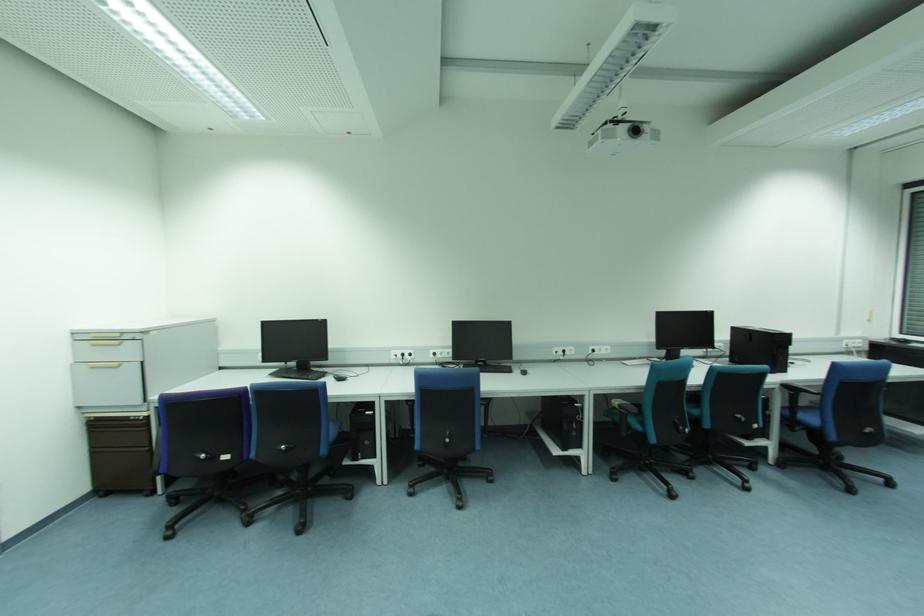
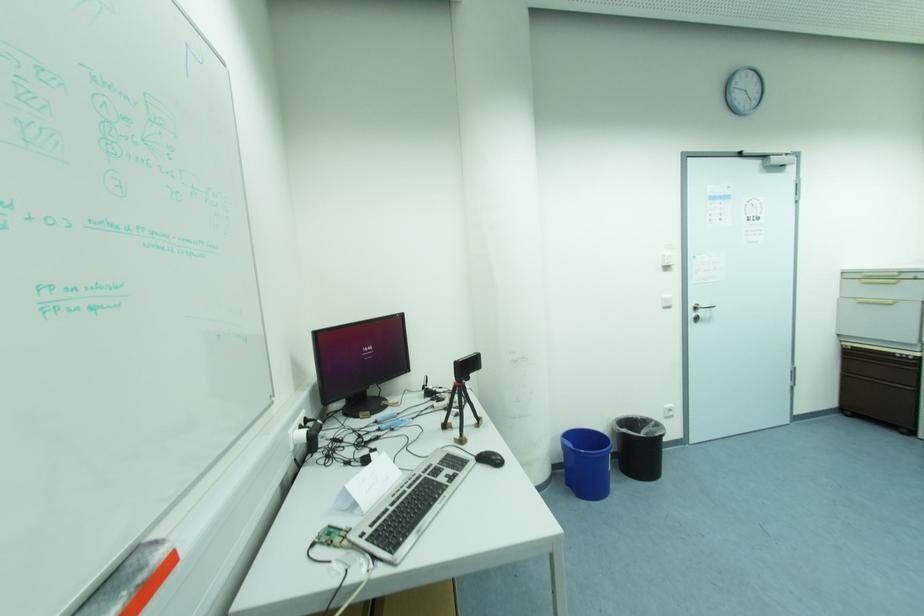
Where in the second image is the point corresponding to point 131,419 from the first image?

(898, 355)